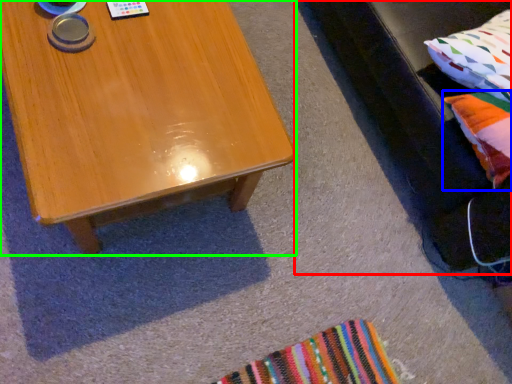
Question: Considering the real-world distances, which object is farthest from couch (highlighted by a red box)? pillow (highlighted by a blue box) or coffee table (highlighted by a green box)?

Choices:
 (A) pillow
 (B) coffee table

Answer: (B)